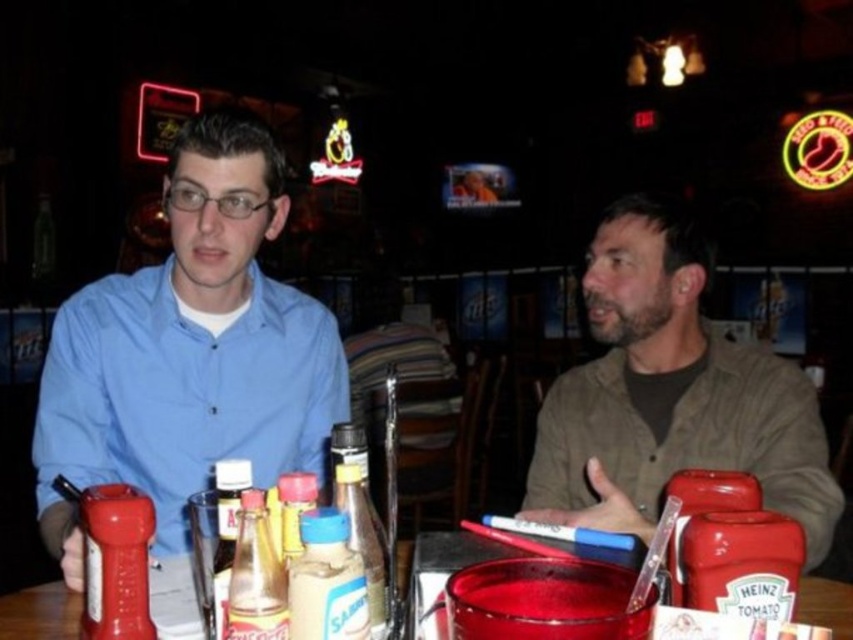
Question: Is matte blue shirt at left below brown textured shirt at right?

Choices:
 (A) no
 (B) yes

Answer: (B)

Question: Which point appears farthest from the camera in this image?

Choices:
 (A) (9, 595)
 (B) (158, 458)
 (C) (554, 448)

Answer: (C)

Question: Considering the relative positions of matte blue shirt at left and translucent plastic cup at center in the image provided, where is matte blue shirt at left located with respect to translucent plastic cup at center?

Choices:
 (A) right
 (B) left

Answer: (A)

Question: Which object appears closest to the camera in this image?

Choices:
 (A) matte blue shirt at left
 (B) brown textured shirt at right

Answer: (A)

Question: Which point is closer to the camera?

Choices:
 (A) translucent plastic cup at center
 (B) brown textured shirt at right
 (C) matte blue shirt at left

Answer: (A)

Question: Is the position of matte blue shirt at left more distant than that of translucent plastic cup at center?

Choices:
 (A) yes
 (B) no

Answer: (A)